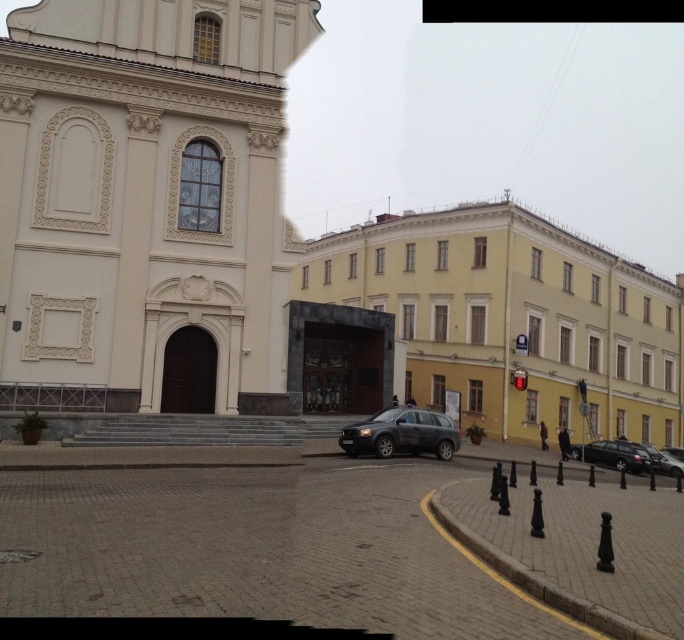
You are a delivery driver who needs to park your dark gray matte suv at center near the white stone church at upper left. Considering the height difference between them, will the suv be visible from the street if parked directly in front of the church?

The white stone church at upper left is taller than the dark gray matte suv at center, so the suv will be visible from the street when parked in front of the church since it is shorter than the church.

You are an urban planner assessing the spatial layout of the city. You need to determine if the beige stone church at center can accommodate a new sculpture in front of it that requires a space twice as wide as the white stone church at upper left. Is the available space sufficient?

The beige stone church at center is wider than the white stone church at upper left. Since the sculpture requires twice the width of the smaller church, the available space may not be sufficient unless the beige church has additional width beyond twice the size of the white one. However, based on the given information, we only know the beige is larger, but not by how much. Therefore, insufficient data to confirm.

You are a city planner who needs to install a new streetlight between the beige stone church at center and the white stone church at upper left. The streetlight requires a minimum of 8 meters of space between the two buildings to be placed safely. Based on the provided information, is this feasible?

The distance between the beige stone church at center and the white stone church at upper left is 7.33 meters. Since the required minimum space for the streetlight is 8 meters, it is not feasible to place the streetlight between them safely.